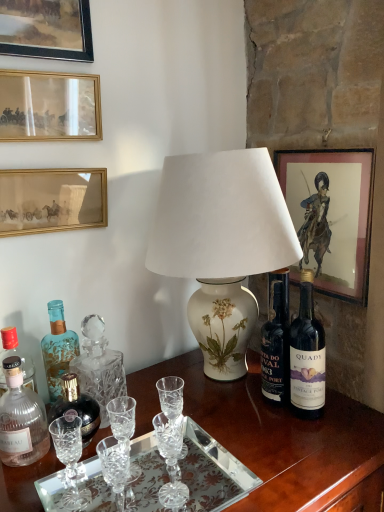
Question: Is matte paper picture frame at upper right, acting as the 4th picture frame starting from the left, facing towards matte glass picture frame at upper left, the 2th picture frame from the left?

Choices:
 (A) yes
 (B) no

Answer: (A)

Question: Does matte paper picture frame at upper right, acting as the 4th picture frame starting from the left, come in front of matte glass picture frame at upper left, which ranks as the third picture frame in right-to-left order?

Choices:
 (A) yes
 (B) no

Answer: (B)

Question: From the image's perspective, is matte paper picture frame at upper right, acting as the 1th picture frame starting from the right, above matte glass picture frame at upper left, the 2th picture frame from the left?

Choices:
 (A) no
 (B) yes

Answer: (A)

Question: Is matte paper picture frame at upper right, acting as the 4th picture frame starting from the left, not close to matte glass picture frame at upper left, the 2th picture frame from the left?

Choices:
 (A) yes
 (B) no

Answer: (B)

Question: Is matte paper picture frame at upper right, acting as the 1th picture frame starting from the right, further to the viewer compared to matte glass picture frame at upper left, the 2th picture frame from the left?

Choices:
 (A) yes
 (B) no

Answer: (A)

Question: Considering their positions, is clear glass tray at lower center located in front of or behind blue glass bottle at left, the third bottle viewed from the front?

Choices:
 (A) front
 (B) behind

Answer: (A)

Question: Which is correct: clear glass tray at lower center is inside blue glass bottle at left, the third bottle viewed from the front, or outside of it?

Choices:
 (A) inside
 (B) outside

Answer: (B)

Question: From a real-world perspective, is clear glass tray at lower center above or below blue glass bottle at left, the first bottle positioned from the back?

Choices:
 (A) below
 (B) above

Answer: (A)

Question: Is clear glass tray at lower center bigger or smaller than blue glass bottle at left, the first bottle positioned from the back?

Choices:
 (A) small
 (B) big

Answer: (B)

Question: Considering their positions, is gold-framed picture at upper left, arranged as the second picture frame when viewed from the right, located in front of or behind dark glass bottle at right?

Choices:
 (A) behind
 (B) front

Answer: (A)

Question: Is point (100, 224) closer or farther from the camera than point (322, 396)?

Choices:
 (A) farther
 (B) closer

Answer: (A)

Question: Considering the positions of gold-framed picture at upper left, arranged as the second picture frame when viewed from the right, and dark glass bottle at right in the image, is gold-framed picture at upper left, arranged as the second picture frame when viewed from the right, taller or shorter than dark glass bottle at right?

Choices:
 (A) tall
 (B) short

Answer: (B)

Question: In terms of width, does gold-framed picture at upper left, the 3th picture frame positioned from the left, look wider or thinner when compared to dark glass bottle at right?

Choices:
 (A) thin
 (B) wide

Answer: (A)

Question: Considering the positions of wooden picture frame at upper left, arranged as the first picture frame when viewed from the left, and wooden desk at center in the image, is wooden picture frame at upper left, arranged as the first picture frame when viewed from the left, wider or thinner than wooden desk at center?

Choices:
 (A) thin
 (B) wide

Answer: (A)

Question: Is wooden picture frame at upper left, marked as the 4th picture frame in a right-to-left arrangement, bigger or smaller than wooden desk at center?

Choices:
 (A) big
 (B) small

Answer: (B)